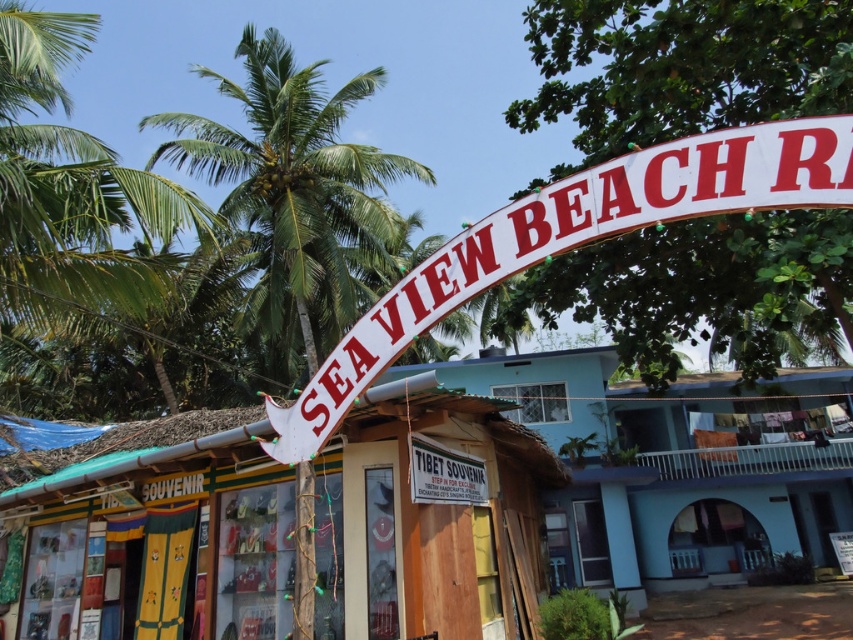
Question: Which of these objects is positioned farthest from the green leafy palm tree at upper center?

Choices:
 (A) white fabric sign at upper center
 (B) white wooden signboard at center

Answer: (A)

Question: Among these objects, which one is nearest to the camera?

Choices:
 (A) green leafy palm tree at upper center
 (B) white fabric sign at upper center

Answer: (B)

Question: Is wooden hut at center above white fabric sign at upper center?

Choices:
 (A) yes
 (B) no

Answer: (B)

Question: Which object is the closest to the white wooden signboard at center?

Choices:
 (A) wooden hut at center
 (B) white fabric sign at upper center

Answer: (B)

Question: Does white wooden signboard at center have a smaller size compared to green leafy palm tree at upper center?

Choices:
 (A) yes
 (B) no

Answer: (A)

Question: Considering the relative positions of white fabric sign at upper center and green leafy palm tree at upper center in the image provided, where is white fabric sign at upper center located with respect to green leafy palm tree at upper center?

Choices:
 (A) left
 (B) right

Answer: (B)